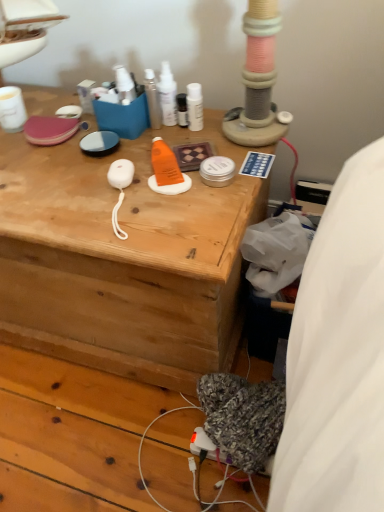
The image size is (384, 512). Identify the location of wooden desk at center. (123, 260).

Describe the element at coordinates (123, 260) in the screenshot. I see `wooden desk at center` at that location.

This screenshot has width=384, height=512. In order to click on wooden desk at center in this screenshot , I will do `click(123, 260)`.